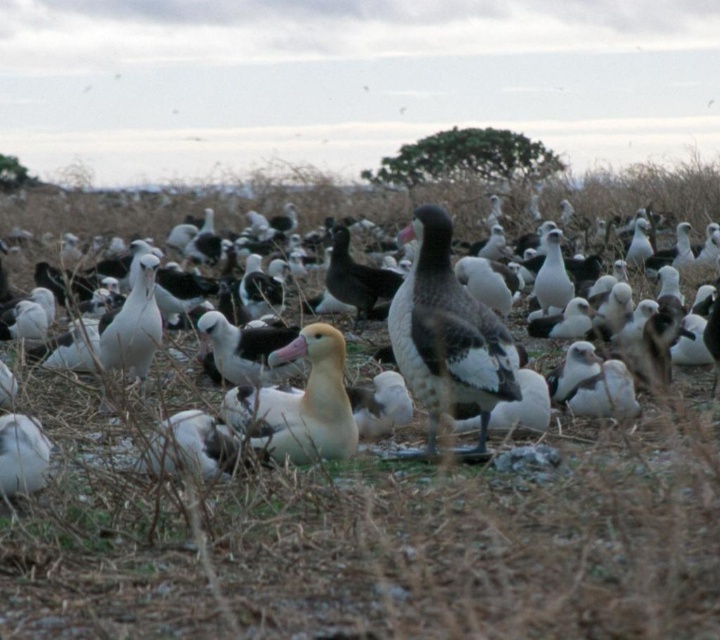
Is white fluffy bird at center to the left of golden brown feathers at center from the viewer's perspective?

Incorrect, white fluffy bird at center is not on the left side of golden brown feathers at center.

The height and width of the screenshot is (640, 720). I want to click on white fluffy bird at center, so [x=395, y=467].

Find the location of a particular element. white fluffy bird at center is located at coordinates (395, 467).

Does golden brown feathers at center appear on the right side of dark brown feathers at center?

No, golden brown feathers at center is not to the right of dark brown feathers at center.

Which of these two, golden brown feathers at center or dark brown feathers at center, stands taller?

dark brown feathers at center is taller.

Is point (269, 362) closer to viewer compared to point (342, 243)?

Yes, it is.

In order to click on golden brown feathers at center in this screenshot , I will do [300, 403].

Is point (463, 532) in front of point (341, 259)?

Yes.

Does white fluffy bird at center have a smaller size compared to dark brown feathers at center?

No.

What are the coordinates of `white fluffy bird at center` in the screenshot? It's located at (395, 467).

Locate an element on the screen. The width and height of the screenshot is (720, 640). white fluffy bird at center is located at coordinates (395, 467).